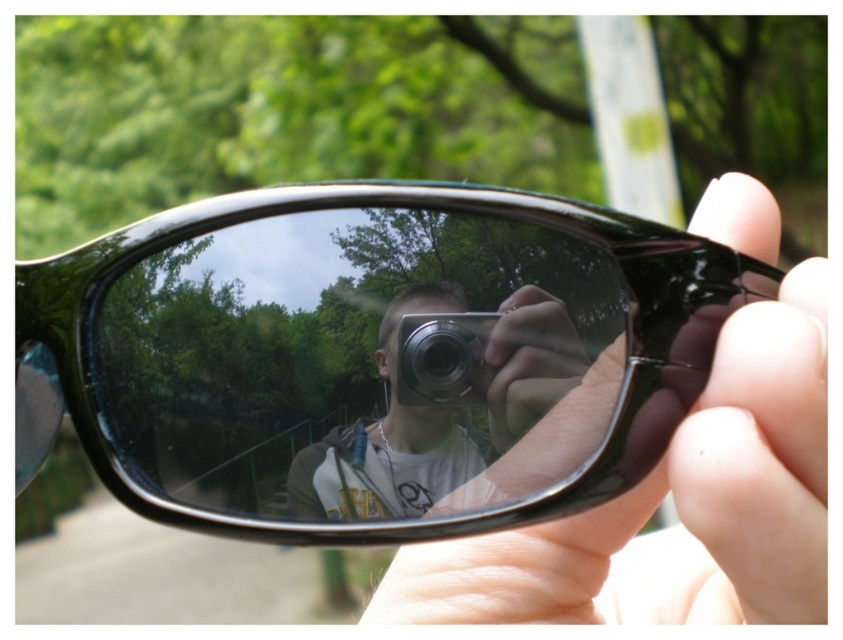
Question: Which object is the farthest from the matte black hand at center?

Choices:
 (A) smooth skin hand at center
 (B) metallic silver camera at center
 (C) black shiny sunglasses at center

Answer: (A)

Question: Can you confirm if smooth skin hand at center is wider than metallic silver camera at center?

Choices:
 (A) no
 (B) yes

Answer: (B)

Question: Is black shiny sunglasses at center wider than matte black hand at center?

Choices:
 (A) yes
 (B) no

Answer: (A)

Question: Can you confirm if matte black hand at center is bigger than metallic silver camera at center?

Choices:
 (A) yes
 (B) no

Answer: (A)

Question: Among these points, which one is nearest to the camera?

Choices:
 (A) (476, 337)
 (B) (702, 438)
 (C) (433, 492)

Answer: (B)

Question: Based on their relative distances, which object is nearer to the smooth skin hand at center?

Choices:
 (A) matte black hand at center
 (B) silver metallic camera at center
 (C) metallic silver camera at center
 (D) black shiny sunglasses at center

Answer: (D)